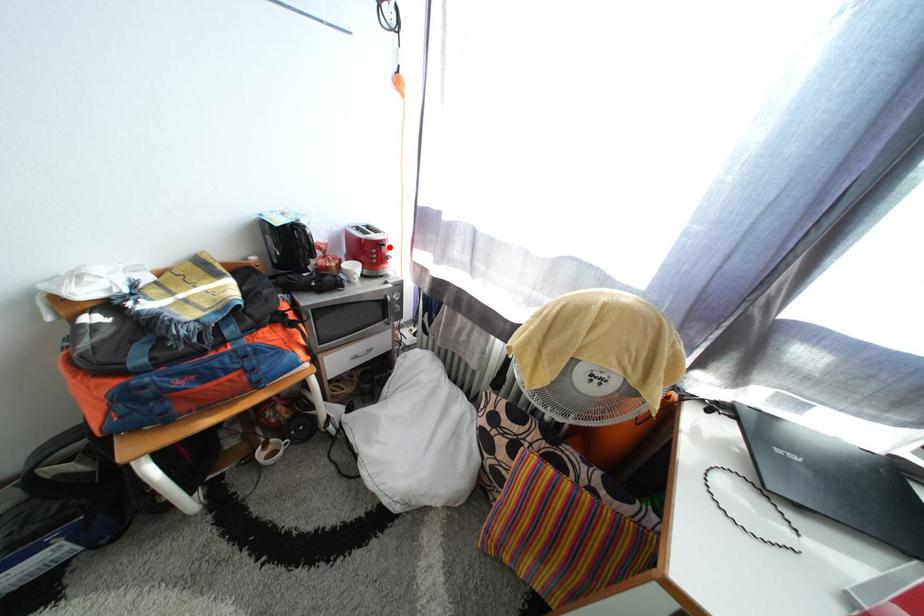
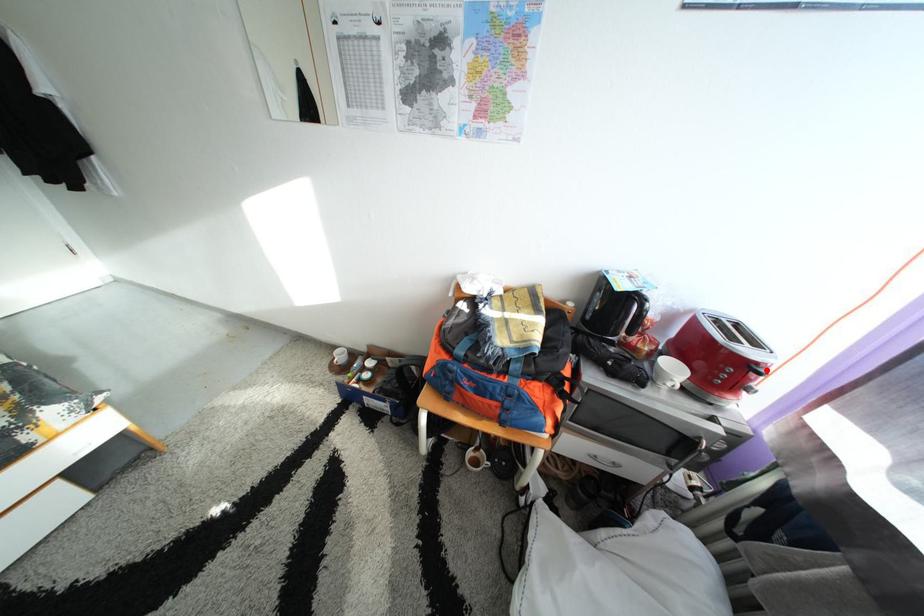
I am providing you with two images of the same scene from different viewpoints. A red point is marked on the first image and another point is marked on the second image. Do the highlighted points in image1 and image2 indicate the same real-world spot?

Yes